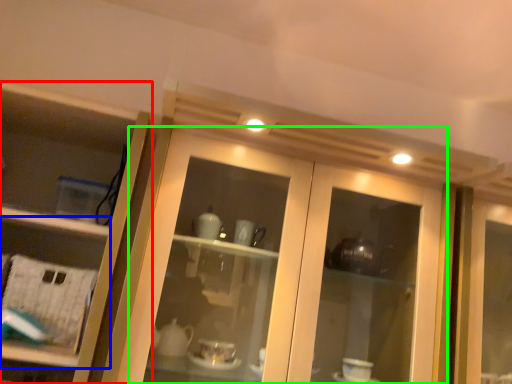
Question: Estimate the real-world distances between objects in this image. Which object is farther from cupboard (highlighted by a red box), shelf (highlighted by a blue box) or door (highlighted by a green box)?

Choices:
 (A) shelf
 (B) door

Answer: (B)